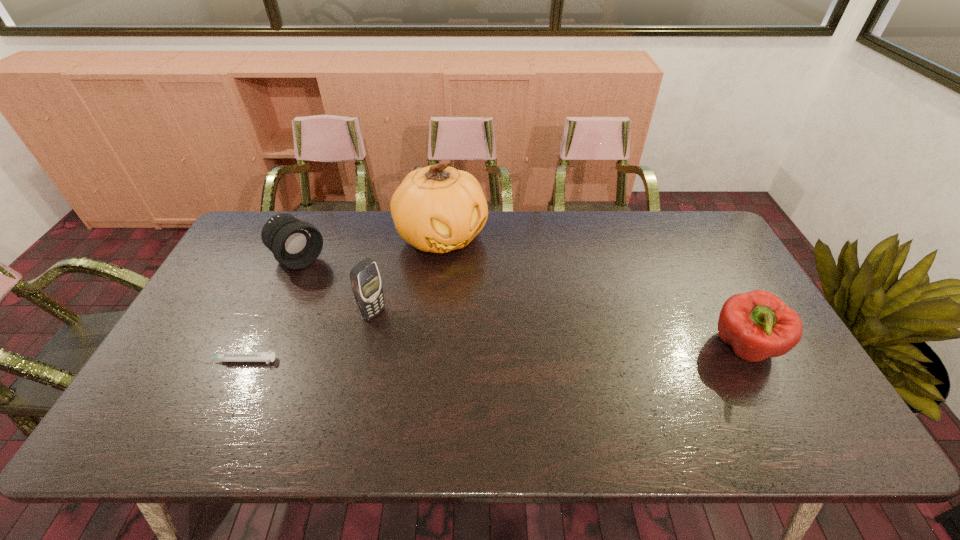
Where is `syringe`? The image size is (960, 540). syringe is located at coordinates (268, 356).

Image resolution: width=960 pixels, height=540 pixels. What are the coordinates of `bell pepper` in the screenshot? It's located at (758, 325).

Where is `telephoto lens`? telephoto lens is located at coordinates (296, 244).

At what (x,y) coordinates should I click in order to perform the action: click on cellular telephone. Please return your answer as a coordinate pair (x, y). Looking at the image, I should click on (366, 284).

Where is `the tallest object`? This screenshot has height=540, width=960. the tallest object is located at coordinates [x=438, y=209].

This screenshot has height=540, width=960. I want to click on vacant space located at the needle end of the syringe, so click(166, 360).

This screenshot has width=960, height=540. Identify the location of vacant space located on the back of the bell pepper. (698, 260).

Identify the location of free spot located at the front element of the telephoto lens. (331, 285).

The width and height of the screenshot is (960, 540). In order to click on free location located 0.110m at the front element of the telephoto lens in this screenshot , I will do `click(335, 288)`.

Where is `free spot located 0.340m at the front element of the telephoto lens`? The image size is (960, 540). free spot located 0.340m at the front element of the telephoto lens is located at coordinates (385, 328).